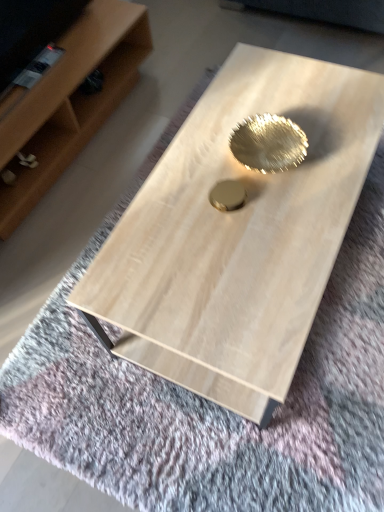
The width and height of the screenshot is (384, 512). Identify the location of light wood shelf at upper left. (70, 102).

Describe the element at coordinates (70, 102) in the screenshot. Image resolution: width=384 pixels, height=512 pixels. I see `light wood shelf at upper left` at that location.

What is the approximate height of light wood shelf at upper left?

light wood shelf at upper left is 31.57 centimeters tall.

Measure the distance between light wood coffee table at center and camera.

The distance of light wood coffee table at center from camera is 32.50 inches.

What do you see at coordinates (237, 234) in the screenshot? Image resolution: width=384 pixels, height=512 pixels. I see `light wood coffee table at center` at bounding box center [237, 234].

You are a GUI agent. You are given a task and a screenshot of the screen. Output one action in this format:
    pyautogui.click(x=<x>, y=<y>)
    Task: Click on the light wood coffee table at center
    This screenshot has height=512, width=384.
    Given the screenshot: What is the action you would take?
    pyautogui.click(x=237, y=234)

The height and width of the screenshot is (512, 384). In order to click on light wood shelf at upper left in this screenshot , I will do `click(70, 102)`.

From the picture: Considering the positions of objects light wood shelf at upper left and light wood coffee table at center in the image provided, who is more to the left, light wood shelf at upper left or light wood coffee table at center?

From the viewer's perspective, light wood shelf at upper left appears more on the left side.

Relative to light wood coffee table at center, is light wood shelf at upper left in front or behind?

Visually, light wood shelf at upper left is located behind light wood coffee table at center.

Which is closer to the camera, [144,29] or [189,144]?

Point [144,29].

From the image's perspective, which one is positioned higher, light wood shelf at upper left or light wood coffee table at center?

light wood shelf at upper left.

From a real-world perspective, is light wood shelf at upper left physically above light wood coffee table at center?

Actually, light wood shelf at upper left is physically below light wood coffee table at center in the real world.

Between light wood shelf at upper left and light wood coffee table at center, which one has larger width?

With larger width is light wood coffee table at center.

Is light wood shelf at upper left taller than light wood coffee table at center?

No.

Considering the sizes of objects light wood shelf at upper left and light wood coffee table at center in the image provided, who is bigger, light wood shelf at upper left or light wood coffee table at center?

light wood coffee table at center is bigger.

Is light wood shelf at upper left inside the boundaries of light wood coffee table at center, or outside?

light wood shelf at upper left lies outside light wood coffee table at center.

Is the surface of light wood shelf at upper left in direct contact with light wood coffee table at center?

light wood shelf at upper left and light wood coffee table at center are not in contact.

Is light wood shelf at upper left oriented towards light wood coffee table at center?

Yes, light wood shelf at upper left is facing light wood coffee table at center.

How much distance is there between light wood shelf at upper left and light wood coffee table at center?

light wood shelf at upper left and light wood coffee table at center are 30.76 inches apart from each other.

I want to click on shelf located on the left of light wood coffee table at center, so click(x=70, y=102).

Is light wood coffee table at center to the right of light wood shelf at upper left from the viewer's perspective?

Indeed, light wood coffee table at center is positioned on the right side of light wood shelf at upper left.

Is light wood coffee table at center positioned before light wood shelf at upper left?

That is True.

Between point (248, 333) and point (127, 36), which one is positioned in front?

The point (248, 333) is in front.

From the image's perspective, is light wood coffee table at center above or below light wood shelf at upper left?

Clearly, from the image's perspective, light wood coffee table at center is below light wood shelf at upper left.

From a real-world perspective, who is located higher, light wood coffee table at center or light wood shelf at upper left?

From a 3D spatial view, light wood coffee table at center is above.

Can you confirm if light wood coffee table at center is wider than light wood shelf at upper left?

Correct, the width of light wood coffee table at center exceeds that of light wood shelf at upper left.

Consider the image. Is light wood coffee table at center taller than light wood shelf at upper left?

Yes.

Which of these two, light wood coffee table at center or light wood shelf at upper left, is bigger?

light wood coffee table at center.

Based on the photo, is light wood coffee table at center located outside light wood shelf at upper left?

That's correct, light wood coffee table at center is outside of light wood shelf at upper left.

Would you consider light wood coffee table at center to be distant from light wood shelf at upper left?

No, light wood coffee table at center is not far from light wood shelf at upper left.

Is light wood coffee table at center facing away from light wood shelf at upper left?

No.

Can you tell me how much light wood coffee table at center and light wood shelf at upper left differ in facing direction?

179 degrees separate the facing orientations of light wood coffee table at center and light wood shelf at upper left.

Where is `shelf that is under the light wood coffee table at center (from a real-world perspective)`? The width and height of the screenshot is (384, 512). shelf that is under the light wood coffee table at center (from a real-world perspective) is located at coordinates (70, 102).

This screenshot has height=512, width=384. I want to click on shelf below the light wood coffee table at center (from a real-world perspective), so click(x=70, y=102).

The height and width of the screenshot is (512, 384). Identify the location of coffee table that appears below the light wood shelf at upper left (from the image's perspective). (237, 234).